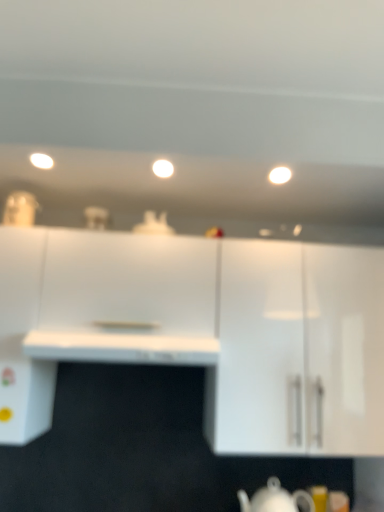
Question: Does white glossy teapot at lower center have a lesser height compared to white glossy cabinet at upper right, the second cabinetry viewed from the left?

Choices:
 (A) yes
 (B) no

Answer: (A)

Question: From the image's perspective, would you say white glossy teapot at lower center is positioned over white glossy cabinet at upper right, the second cabinetry viewed from the left?

Choices:
 (A) no
 (B) yes

Answer: (A)

Question: Can you confirm if white glossy teapot at lower center is taller than white glossy cabinet at upper right, marked as the 1th cabinetry in a right-to-left arrangement?

Choices:
 (A) yes
 (B) no

Answer: (B)

Question: Could white glossy cabinet at upper right, the second cabinetry viewed from the left, be considered to be inside white glossy teapot at lower center?

Choices:
 (A) yes
 (B) no

Answer: (B)

Question: Considering the relative sizes of white glossy teapot at lower center and white glossy cabinet at upper right, marked as the 1th cabinetry in a right-to-left arrangement, in the image provided, is white glossy teapot at lower center smaller than white glossy cabinet at upper right, marked as the 1th cabinetry in a right-to-left arrangement,?

Choices:
 (A) no
 (B) yes

Answer: (B)

Question: Is white glossy light fixture at center, which appears as the 2th lighting when viewed from the right, inside or outside of white matte cabinet at left, the second cabinetry from the right?

Choices:
 (A) outside
 (B) inside

Answer: (A)

Question: From the image's perspective, is white glossy light fixture at center, which appears as the 2th lighting when viewed from the right, positioned above or below white matte cabinet at left, acting as the 1th cabinetry starting from the left?

Choices:
 (A) above
 (B) below

Answer: (A)

Question: Is point (152, 169) closer or farther from the camera than point (31, 286)?

Choices:
 (A) closer
 (B) farther

Answer: (B)

Question: Is white glossy light fixture at center, which appears as the 2th lighting when viewed from the right, wider or thinner than white matte cabinet at left, the second cabinetry from the right?

Choices:
 (A) wide
 (B) thin

Answer: (B)

Question: From the image's perspective, is white matte cabinet at left, acting as the 1th cabinetry starting from the left, positioned above or below white glossy light fixture at upper left, the 3th lighting when ordered from right to left?

Choices:
 (A) below
 (B) above

Answer: (A)

Question: From a real-world perspective, is white matte cabinet at left, acting as the 1th cabinetry starting from the left, positioned above or below white glossy light fixture at upper left, which is the first lighting from left to right?

Choices:
 (A) above
 (B) below

Answer: (B)

Question: Does point (51, 373) appear closer or farther from the camera than point (43, 164)?

Choices:
 (A) farther
 (B) closer

Answer: (A)

Question: Is white matte cabinet at left, acting as the 1th cabinetry starting from the left, wider or thinner than white glossy light fixture at upper left, the 3th lighting when ordered from right to left?

Choices:
 (A) thin
 (B) wide

Answer: (B)

Question: From a real-world perspective, is white glossy teapot at lower center positioned above or below white glossy cabinet at upper right, marked as the 1th cabinetry in a right-to-left arrangement?

Choices:
 (A) above
 (B) below

Answer: (B)

Question: In terms of size, does white glossy teapot at lower center appear bigger or smaller than white glossy cabinet at upper right, the second cabinetry viewed from the left?

Choices:
 (A) small
 (B) big

Answer: (A)